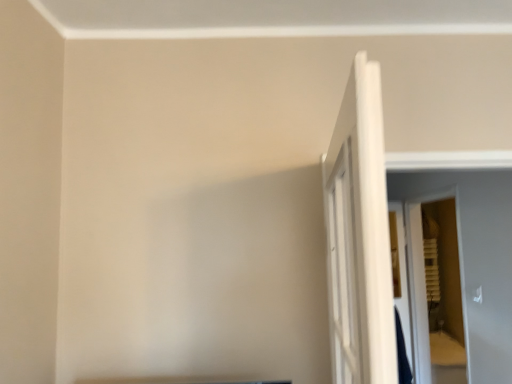
Question: Based on their positions, is white wooden door at right located to the left or right of white wooden screen door at right?

Choices:
 (A) right
 (B) left

Answer: (B)

Question: From the image's perspective, is white wooden door at right above or below white wooden screen door at right?

Choices:
 (A) above
 (B) below

Answer: (A)

Question: From a real-world perspective, relative to white wooden screen door at right, is white wooden door at right vertically above or below?

Choices:
 (A) above
 (B) below

Answer: (A)

Question: From a real-world perspective, is white wooden screen door at right above or below white wooden door at right?

Choices:
 (A) above
 (B) below

Answer: (B)

Question: In terms of width, does white wooden screen door at right look wider or thinner when compared to white wooden door at right?

Choices:
 (A) thin
 (B) wide

Answer: (B)

Question: Is white wooden screen door at right bigger or smaller than white wooden door at right?

Choices:
 (A) small
 (B) big

Answer: (B)

Question: Is white wooden screen door at right taller or shorter than white wooden door at right?

Choices:
 (A) short
 (B) tall

Answer: (B)